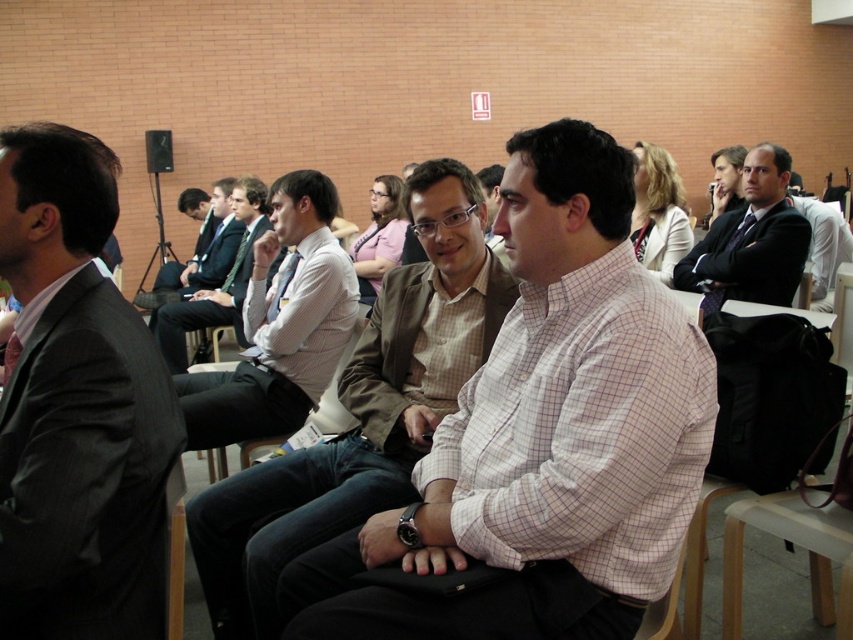
You are standing in the conference room and need to determine the relative positions of two points marked in the scene. Which point is closer to you, point (316, 525) or point (766, 284)?

Point (316, 525) is closer to the viewer than point (766, 284).

You are a photographer trying to capture a clear photo of the light brown textured blazer at center. However, the dark gray suit at left is blocking your view. Can you move around to the right side to get an unobstructed shot?

The dark gray suit at left is in front of the light brown textured blazer at center, so moving to the right side might allow you to see around the dark gray suit at left and get an unobstructed view of the light brown textured blazer at center.

Looking at this image, in the conference room scene with the brick walls and bright lighting, there is a point marked at coordinates [363,410]. Which object from the list below is located at this point? Choose from the options below. A. A man in a pink checkered shirt B. A light brown textured blazer C. A man on the far left who is partially cut off D. A man in a brown blazer over a checkered shirt

The point at coordinates [363,410] marks the light brown textured blazer at center, so the correct answer is B.